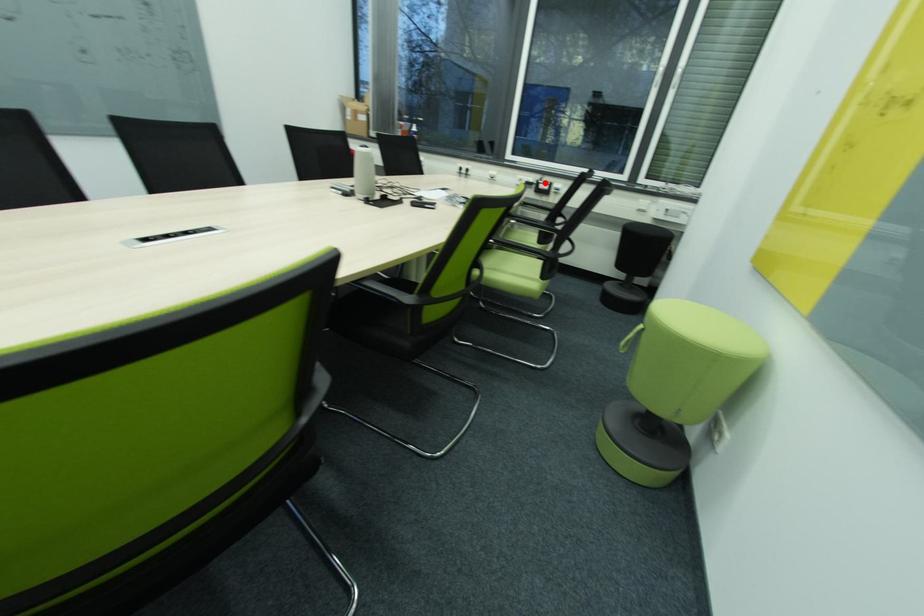
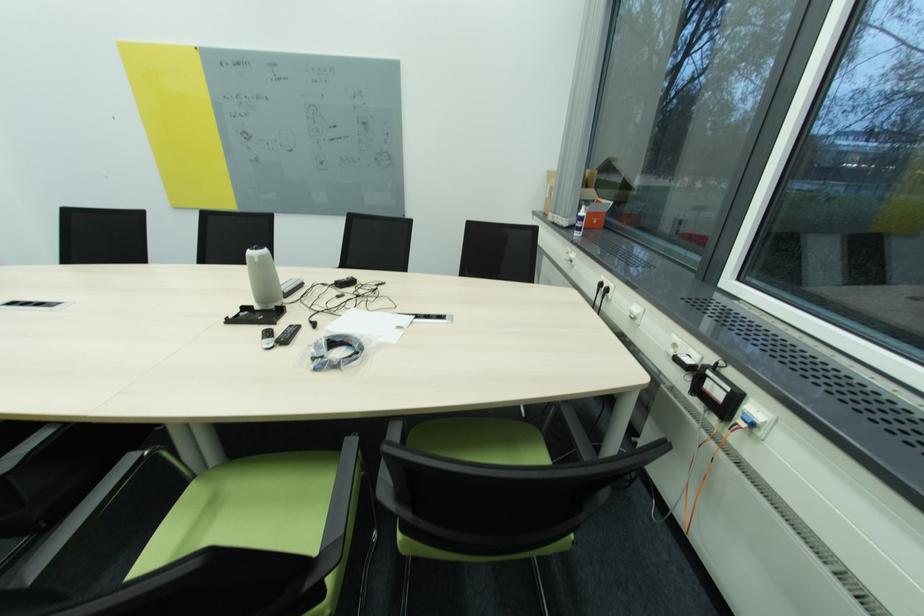
The point at the highlighted location is marked in the first image. Where is the corresponding point in the second image?

(713, 373)